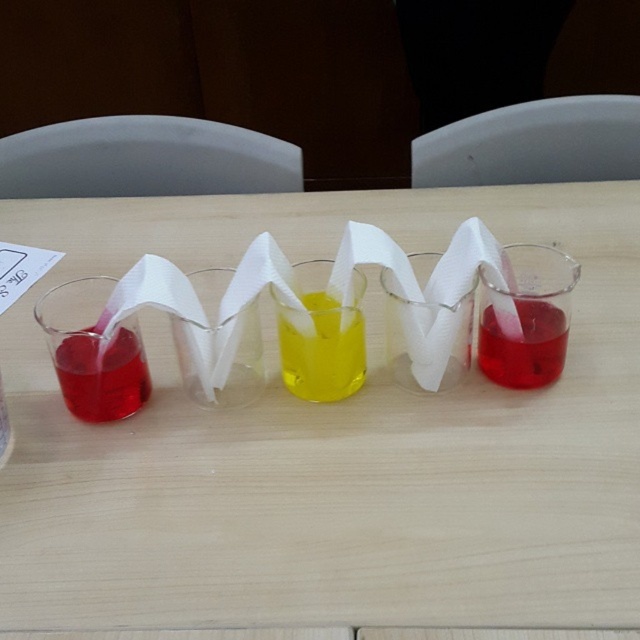
Question: Is matte plastic beaker at left closer to camera compared to matte plastic beaker at right?

Choices:
 (A) no
 (B) yes

Answer: (B)

Question: Does matte plastic beaker at left appear over matte plastic beaker at right?

Choices:
 (A) no
 (B) yes

Answer: (A)

Question: Which point is closer to the camera?

Choices:
 (A) (308, 384)
 (B) (147, 384)
 (C) (520, 362)
 (D) (36, 596)

Answer: (D)

Question: Which point is closer to the camera?

Choices:
 (A) matte plastic beaker at right
 (B) matte plastic beaker at left

Answer: (B)

Question: Does yellow translucent liquid at center appear under matte plastic beaker at left?

Choices:
 (A) yes
 (B) no

Answer: (B)

Question: Which of the following is the farthest from the observer?

Choices:
 (A) (356, 372)
 (B) (100, 362)
 (C) (198, 502)
 (D) (490, 317)

Answer: (A)